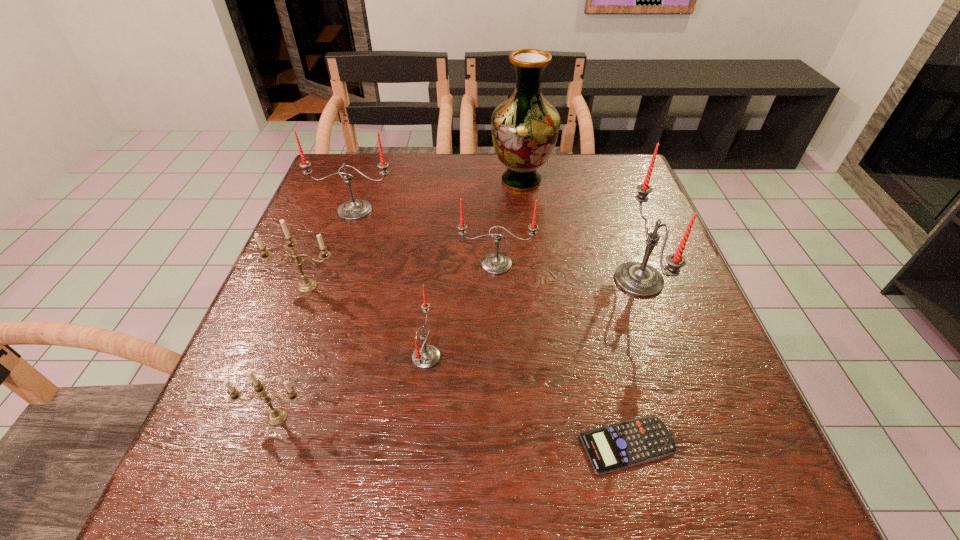
Find the location of a particular element. The height and width of the screenshot is (540, 960). vacant space at the far edge of the desktop is located at coordinates (456, 153).

This screenshot has width=960, height=540. In order to click on free space at the near edge of the desktop in this screenshot , I will do `click(567, 450)`.

At what (x,y) coordinates should I click in order to perform the action: click on vacant space at the left edge. Please return your answer as a coordinate pair (x, y). Image resolution: width=960 pixels, height=540 pixels. Looking at the image, I should click on (351, 271).

Where is `vacant region at the right edge of the desktop`? Image resolution: width=960 pixels, height=540 pixels. vacant region at the right edge of the desktop is located at coordinates (660, 364).

I want to click on vacant space at the far left corner of the desktop, so click(x=350, y=195).

In the image, there is a desktop. Identify the location of free region at the far right corner. This screenshot has height=540, width=960. (604, 161).

The height and width of the screenshot is (540, 960). What are the coordinates of `vacant region at the near right corner of the desktop` in the screenshot? It's located at (773, 469).

Locate an element on the screen. vacant space that's between the tallest object and the bigger metallic candle is located at coordinates (414, 233).

Identify the location of vacant region between the farther metallic candle and the nearest red candle. This screenshot has height=540, width=960. (367, 321).

The height and width of the screenshot is (540, 960). In order to click on empty space between the shortest object and the second red candle from left to right in this screenshot , I will do `click(527, 401)`.